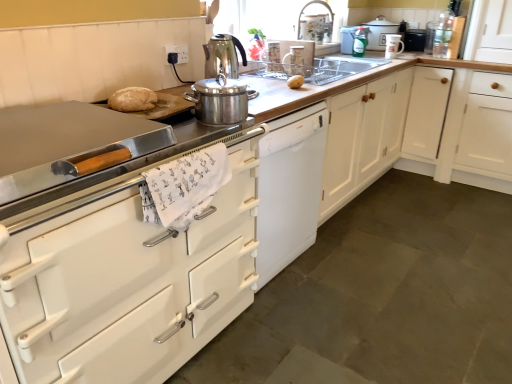
Locate an element on the screen. The image size is (512, 384). free space that is to the left of green glossy spray bottle at upper center, which appears as the 2th kitchen appliance when viewed from the back is located at coordinates (339, 50).